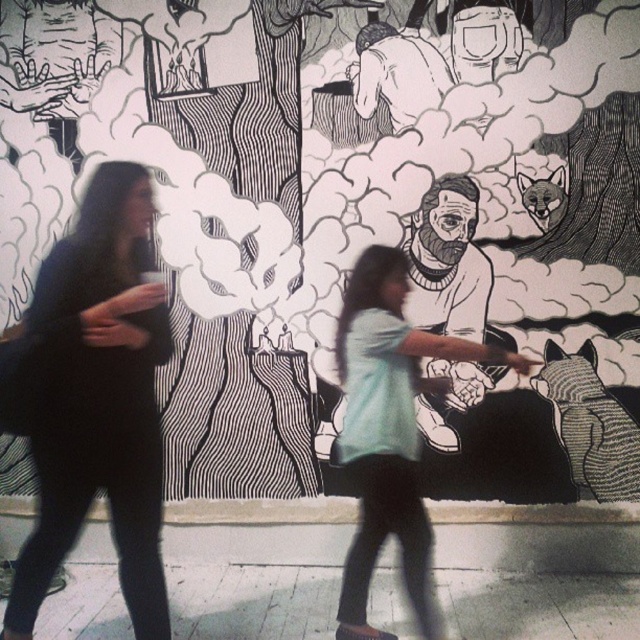
Who is more distant from viewer, (115, 228) or (464, 344)?

The point (464, 344) is behind.

How far apart are black matte dress at left and light blue shirt at center?

They are 1.07 meters apart.

Does point (116, 195) come behind point (387, 308)?

No, it is in front of (387, 308).

Locate an element on the screen. This screenshot has height=640, width=640. black matte dress at left is located at coordinates (92, 397).